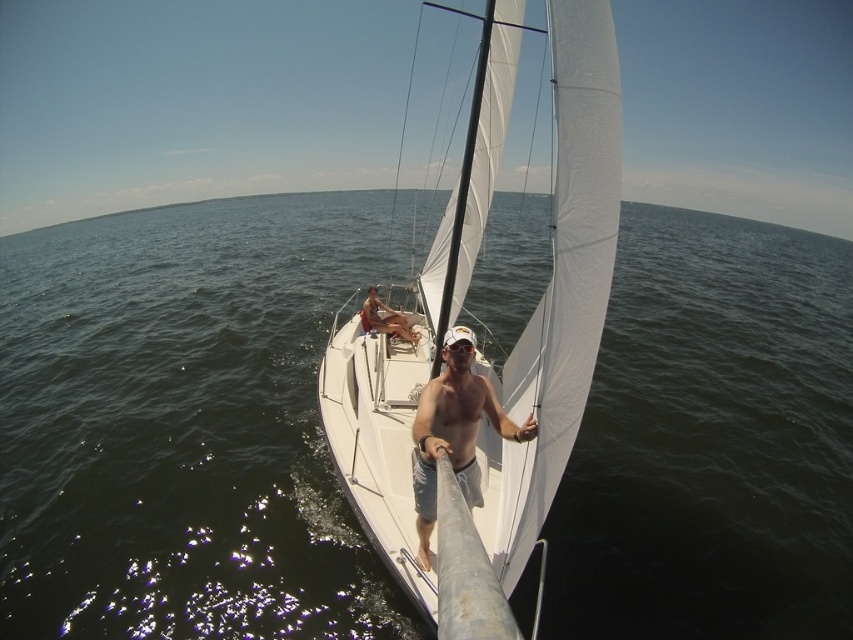
Is point (807, 365) behind point (428, 413)?

That is True.

Measure the distance between dark green water at center and shiny metallic pole at center.

dark green water at center is 47.99 feet from shiny metallic pole at center.

What are the coordinates of `dark green water at center` in the screenshot? It's located at (183, 426).

Where is `dark green water at center`? The image size is (853, 640). dark green water at center is located at coordinates (183, 426).

Is white matte sailboat at center shorter than shiny metallic pole at center?

Incorrect, white matte sailboat at center's height does not fall short of shiny metallic pole at center's.

Which of these two, white matte sailboat at center or shiny metallic pole at center, stands shorter?

With less height is shiny metallic pole at center.

Is point (518, 42) positioned before point (454, 472)?

No, it is behind (454, 472).

Where is `white matte sailboat at center`? white matte sailboat at center is located at coordinates click(560, 289).

Does dark green water at center have a greater width compared to tan skin man at center?

Yes, dark green water at center is wider than tan skin man at center.

Describe the element at coordinates (183, 426) in the screenshot. This screenshot has height=640, width=853. I see `dark green water at center` at that location.

Find the location of a particular element. The width and height of the screenshot is (853, 640). dark green water at center is located at coordinates (183, 426).